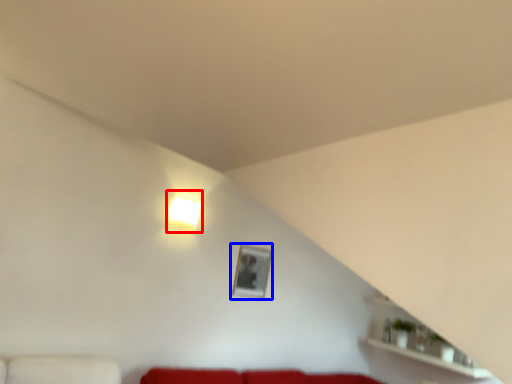
Question: Which of the following is the closest to the observer, lamp (highlighted by a red box) or picture frame (highlighted by a blue box)?

Choices:
 (A) lamp
 (B) picture frame

Answer: (A)